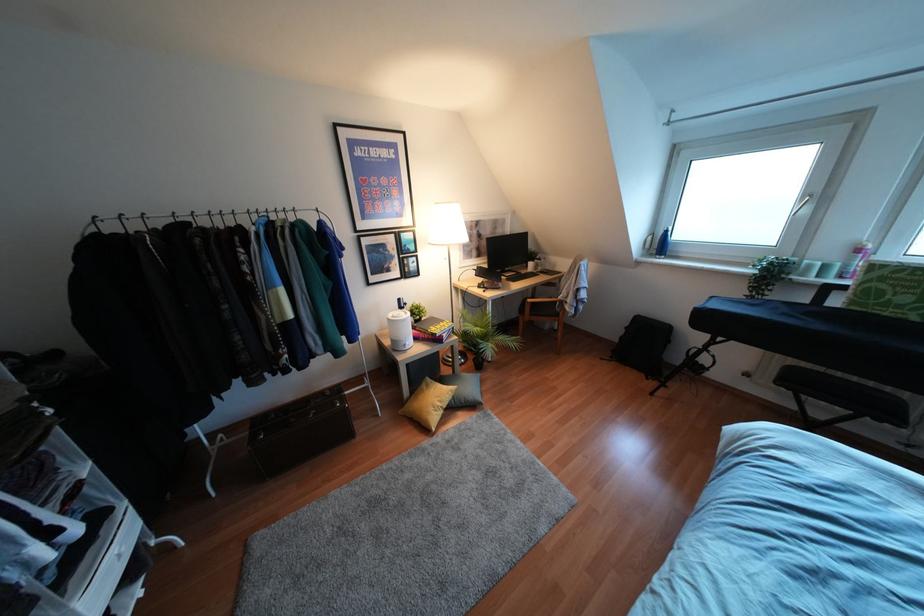
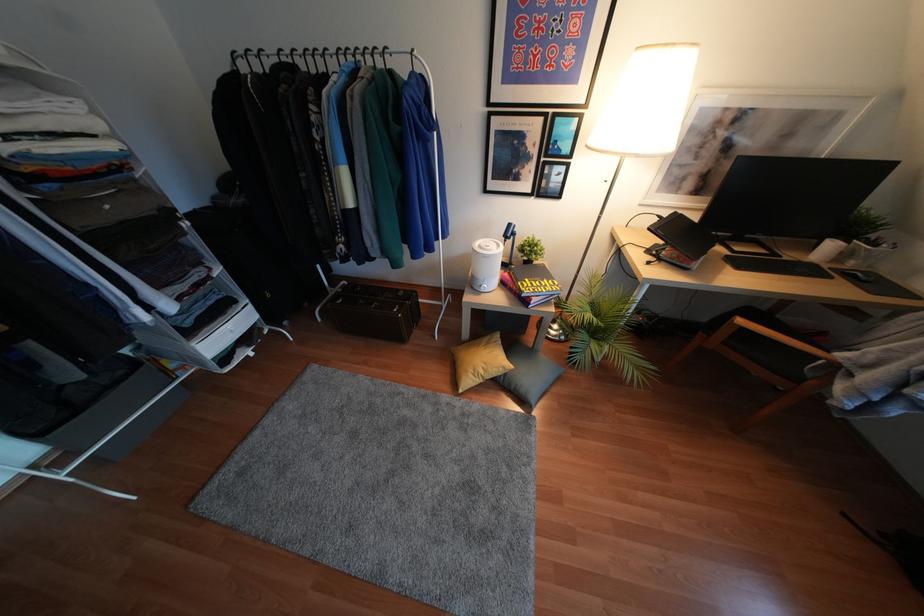
Locate, in the second image, the point that corresponds to [529,300] in the first image.

(739, 321)